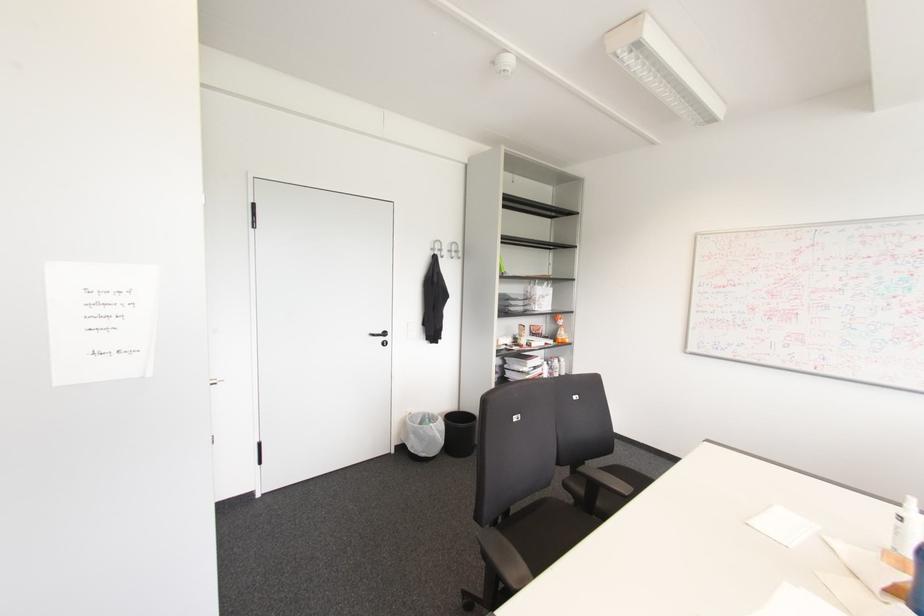
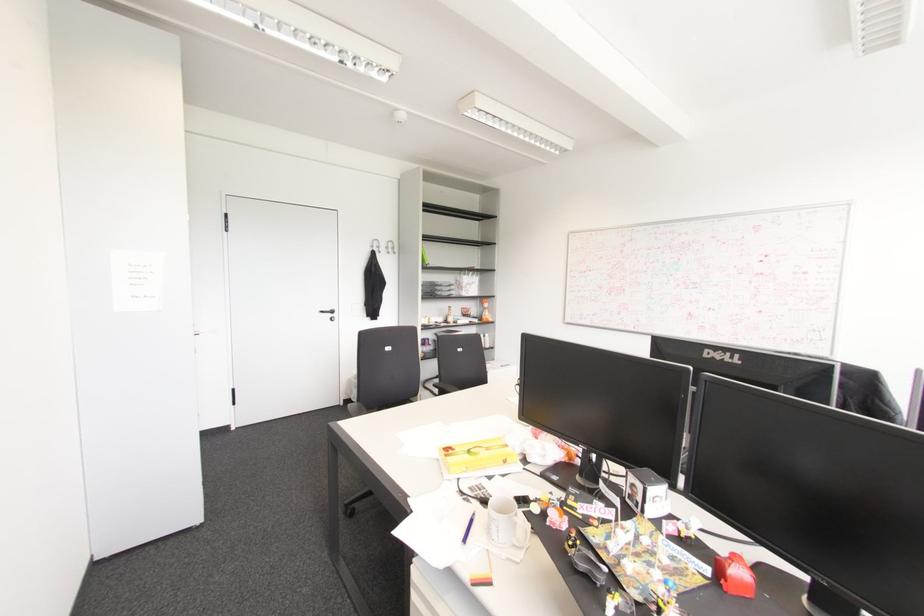
What movement of the cameraman would produce the second image?

The cameraman walked toward right, backward.